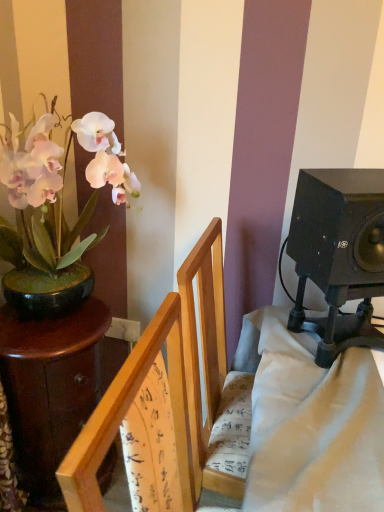
This screenshot has width=384, height=512. I want to click on free space above dark brown wooden table at left (from a real-world perspective), so click(56, 325).